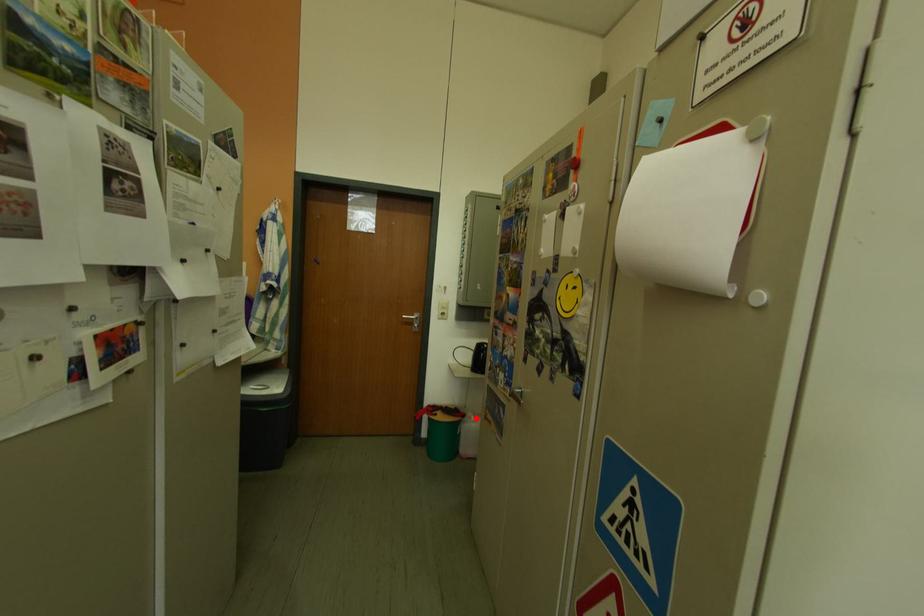
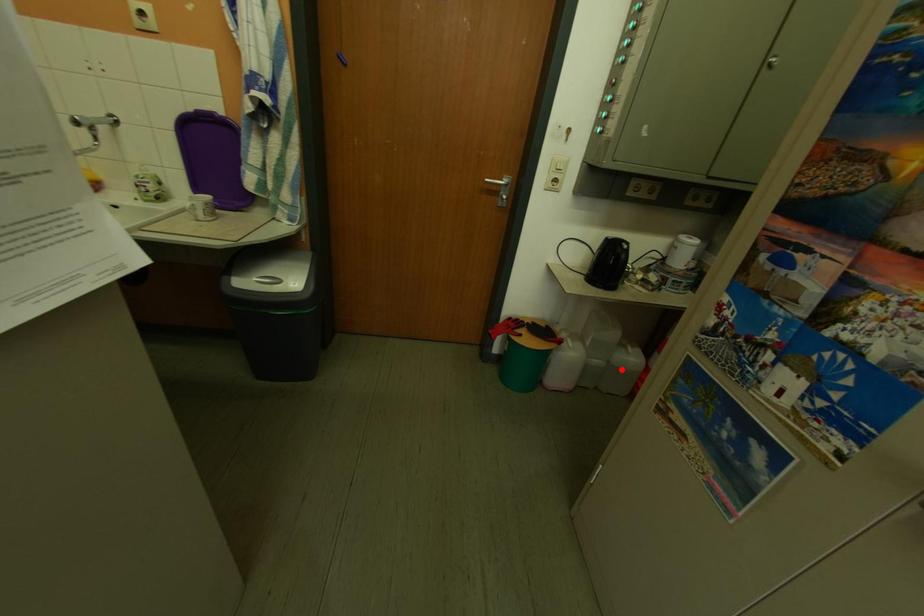
I am providing you with two images of the same scene from different viewpoints. A red point is marked on the first image and another point is marked on the second image. Are the points marked in image1 and image2 representing the same 3D position?

No